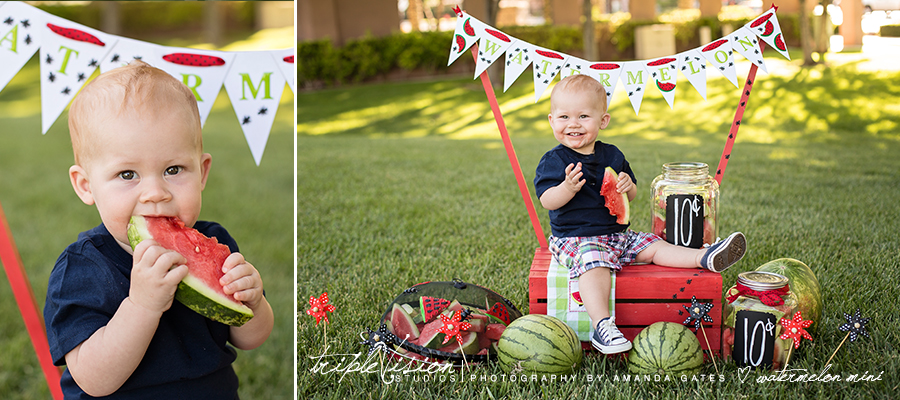
What are the coordinates of `glass jar` in the screenshot? It's located at (708, 222).